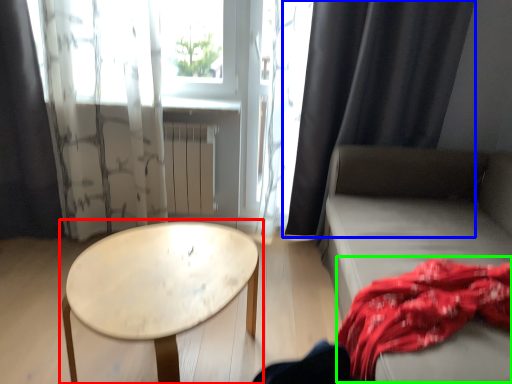
Question: Which object is the closest to the table (highlighted by a red box)? Choose among these: curtain (highlighted by a blue box) or blanket (highlighted by a green box).

Choices:
 (A) curtain
 (B) blanket

Answer: (B)